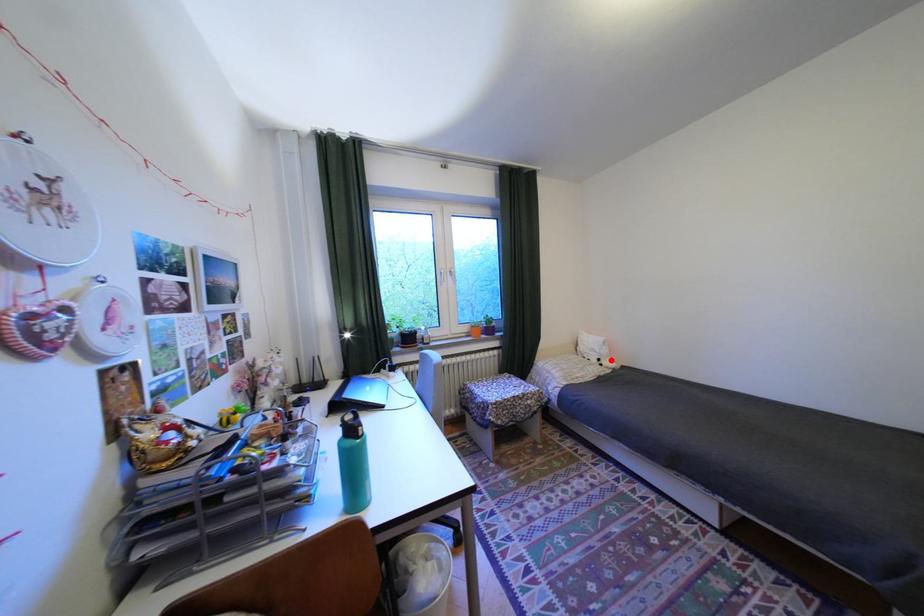
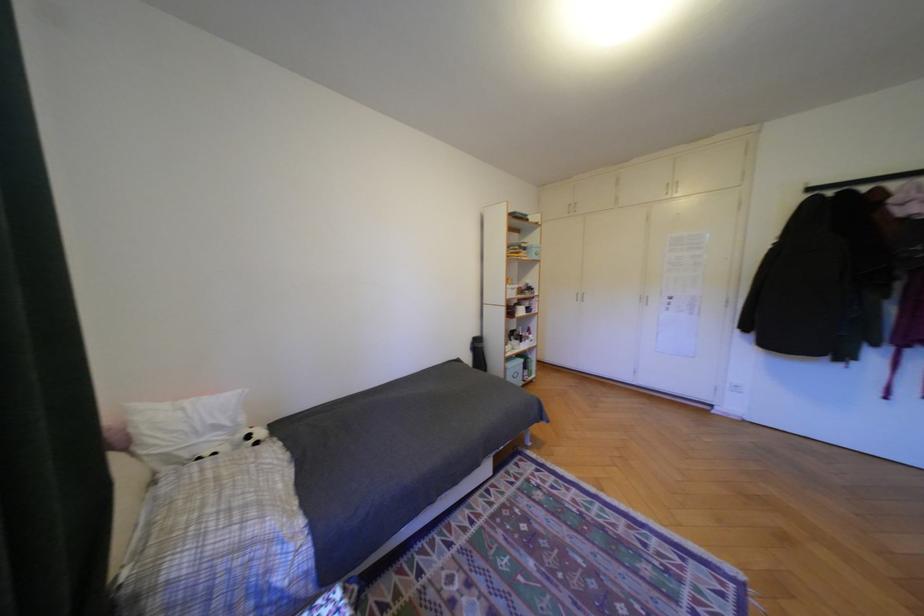
Question: I am providing you with two images of the same scene from different viewpoints. A red point is shown in image1. For the corresponding object point in image2, is it positioned nearer or farther from the camera?

Choices:
 (A) Nearer
 (B) Farther

Answer: (A)